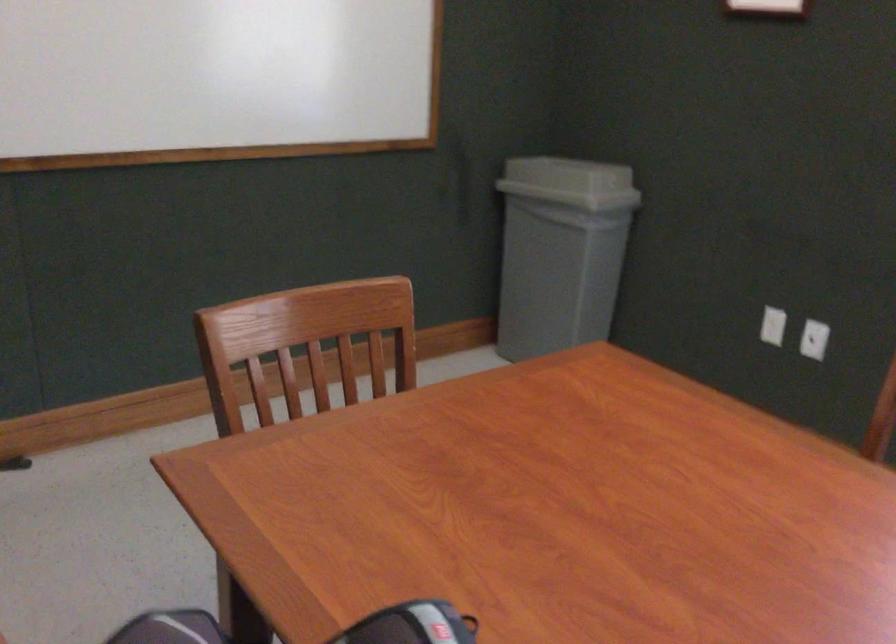
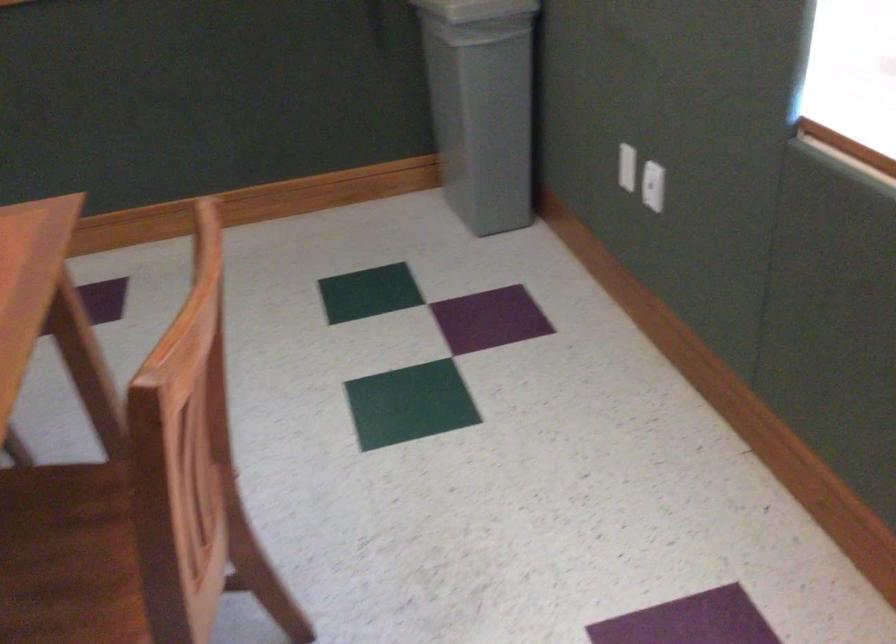
Which direction would the cameraman need to move to produce the second image?

The cameraman walked toward right, forward.